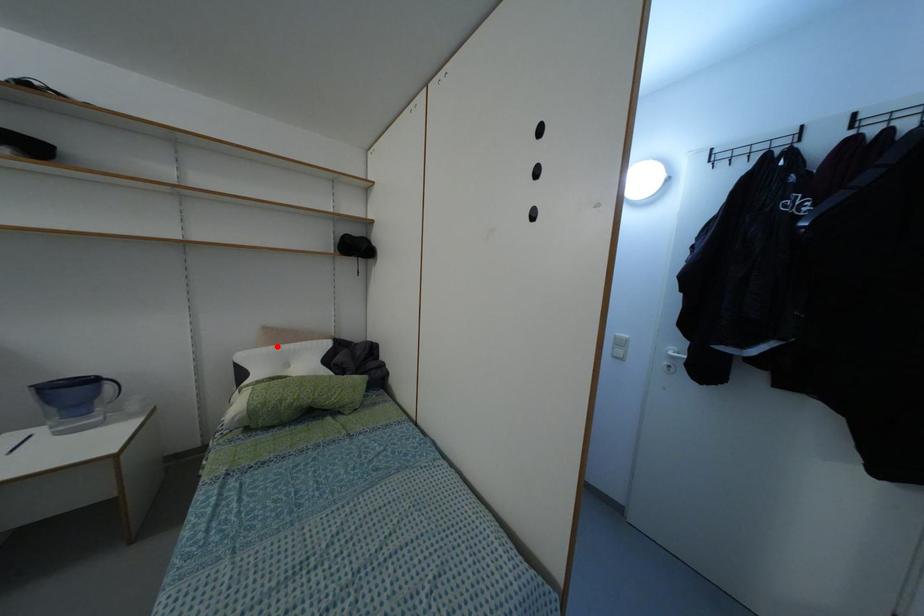
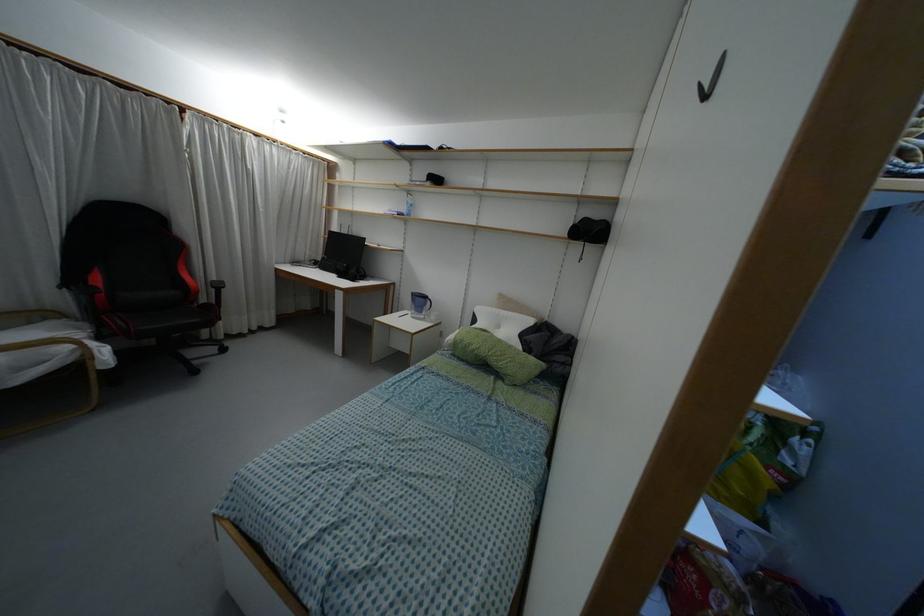
Find the pixel in the second image that matches the highlighted location in the first image.

(496, 310)